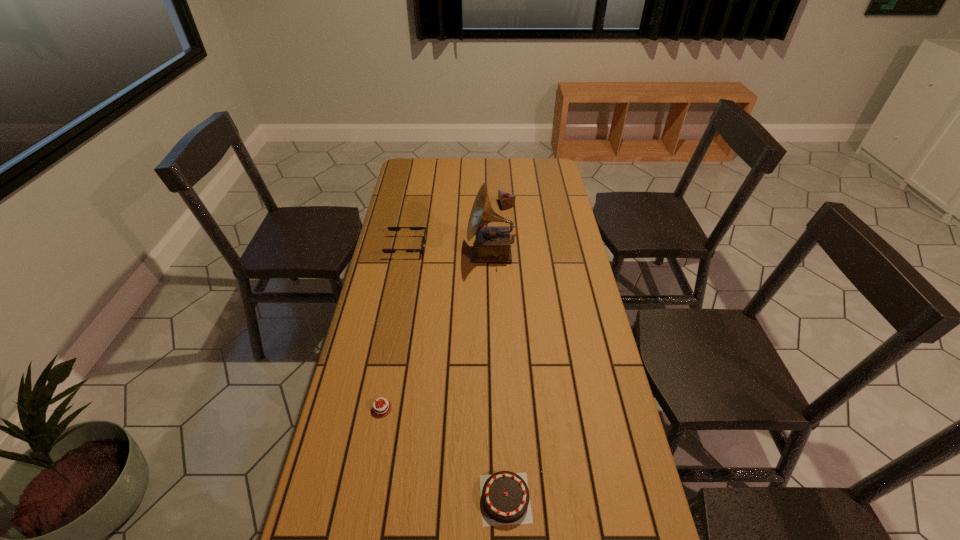
Identify the location of the third closest object to the tallest object. (x=379, y=408).

Select which object appears as the closest to the phonograph record. Please provide its 2D coordinates. Your answer should be formatted as a tuple, i.e. [(x, y)], where the tuple contains the x and y coordinates of a point satisfying the conditions above.

[(389, 228)]

You are a GUI agent. You are given a task and a screenshot of the screen. Output one action in this format:
    pyautogui.click(x=<x>, y=<y>)
    Task: Click on the closest chocolate cake relative to the sunglasses
    Image resolution: width=960 pixels, height=540 pixels.
    Given the screenshot: What is the action you would take?
    pyautogui.click(x=506, y=200)

Find the location of a particular element. The height and width of the screenshot is (540, 960). the second closest chocolate cake to the nearest object is located at coordinates (506, 200).

Find the location of `free space that satisfies the following two spatial constraints: 1. on the front side of the farthest chocolate cake; 2. on the horn of the tallest object`. free space that satisfies the following two spatial constraints: 1. on the front side of the farthest chocolate cake; 2. on the horn of the tallest object is located at coordinates pyautogui.click(x=510, y=253).

This screenshot has height=540, width=960. In order to click on blank area in the image that satisfies the following two spatial constraints: 1. on the temples of the sunglasses; 2. on the back side of the fourth farthest object in this screenshot , I will do `click(375, 408)`.

At what (x,y) coordinates should I click in order to perform the action: click on free space in the image that satisfies the following two spatial constraints: 1. on the horn of the phonograph record; 2. on the left side of the nearest chocolate cake. Please return your answer as a coordinate pair (x, y). Image resolution: width=960 pixels, height=540 pixels. Looking at the image, I should click on (499, 498).

Image resolution: width=960 pixels, height=540 pixels. I want to click on free space that satisfies the following two spatial constraints: 1. on the front side of the second nearest object; 2. on the right side of the second tallest chocolate cake, so click(x=365, y=498).

Where is `free spot that satisfies the following two spatial constraints: 1. on the temples of the shortest chocolate cake; 2. on the left side of the sunglasses`? This screenshot has width=960, height=540. free spot that satisfies the following two spatial constraints: 1. on the temples of the shortest chocolate cake; 2. on the left side of the sunglasses is located at coordinates (375, 408).

Where is `free space that satisfies the following two spatial constraints: 1. on the front side of the fourth tallest object; 2. on the right side of the leftmost chocolate cake`? Image resolution: width=960 pixels, height=540 pixels. free space that satisfies the following two spatial constraints: 1. on the front side of the fourth tallest object; 2. on the right side of the leftmost chocolate cake is located at coordinates (365, 498).